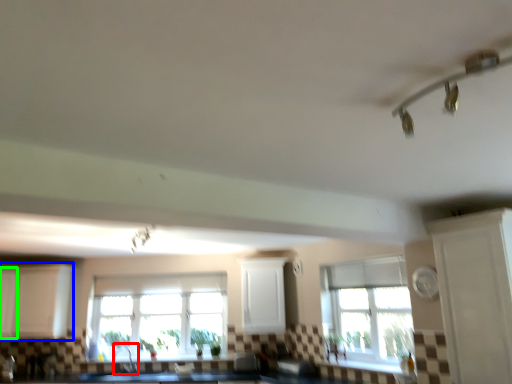
Question: Estimate the real-world distances between objects in this image. Which object is closer to faucet (highlighted by a red box), cabinetry (highlighted by a blue box) or cabinetry (highlighted by a green box)?

Choices:
 (A) cabinetry
 (B) cabinetry

Answer: (A)